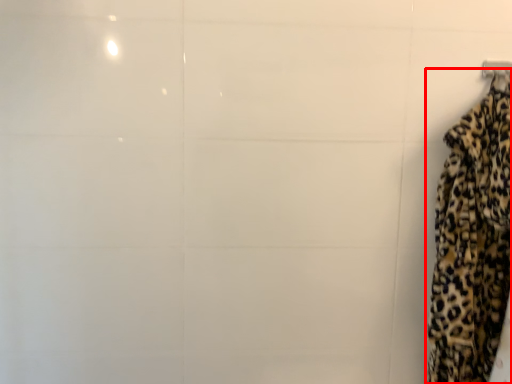
Question: From the image's perspective, what is the correct spatial positioning of curtain (annotated by the red box) in reference to hanger?

Choices:
 (A) above
 (B) below

Answer: (B)